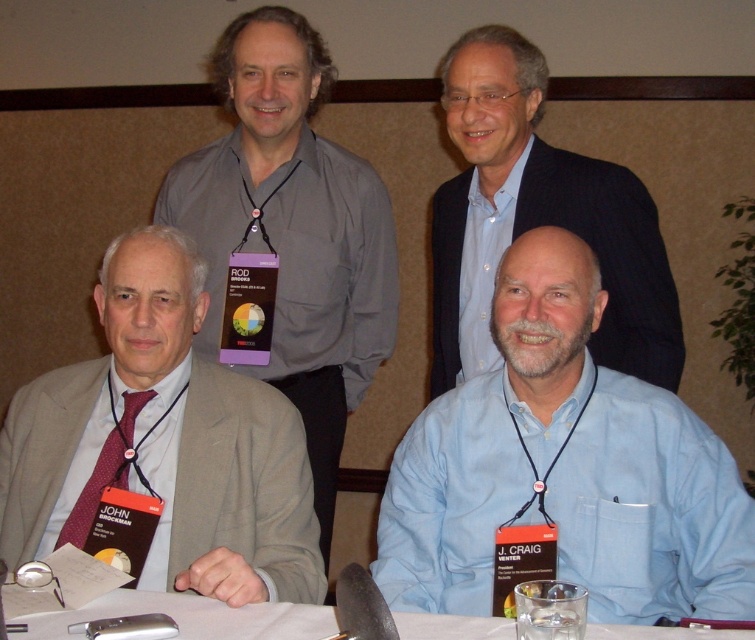
Question: Can you confirm if light beige suit at lower left is wider than blue shirt at upper center?

Choices:
 (A) yes
 (B) no

Answer: (A)

Question: Which point is farther to the camera?

Choices:
 (A) (151, 380)
 (B) (492, 468)
 (C) (236, 112)

Answer: (C)

Question: Which point appears farthest from the camera in this image?

Choices:
 (A) (193, 492)
 (B) (217, 168)
 (C) (82, 534)

Answer: (B)

Question: Does blue shirt at upper center appear on the left side of maroon textured tie at lower left?

Choices:
 (A) yes
 (B) no

Answer: (B)

Question: Is blue shirt at upper center positioned behind white paper table at lower center?

Choices:
 (A) no
 (B) yes

Answer: (B)

Question: Considering the real-world distances, which object is closest to the blue shirt at upper center?

Choices:
 (A) white paper table at lower center
 (B) maroon textured tie at lower left
 (C) light beige suit at lower left

Answer: (C)